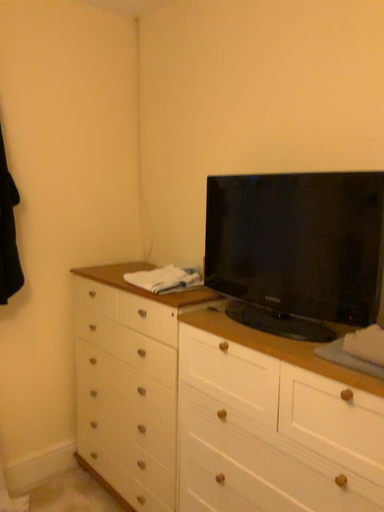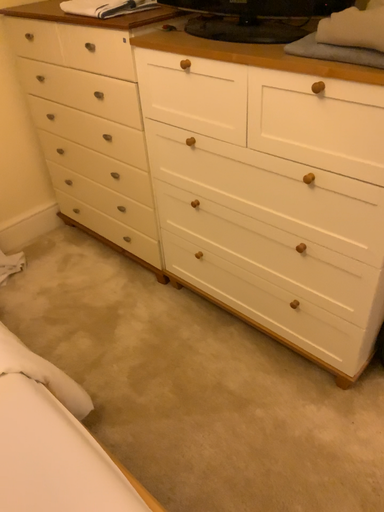
Question: Which way did the camera rotate in the video?

Choices:
 (A) rotated downward
 (B) rotated upward

Answer: (A)